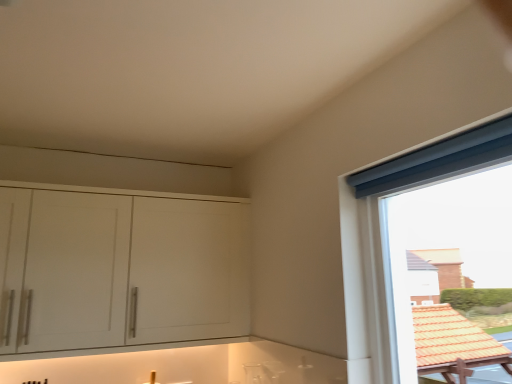
Question: From a real-world perspective, does blue fabric curtain at upper right stand above white matte cabinet at left?

Choices:
 (A) no
 (B) yes

Answer: (A)

Question: Considering the relative sizes of blue fabric curtain at upper right and white matte cabinet at left in the image provided, is blue fabric curtain at upper right wider than white matte cabinet at left?

Choices:
 (A) yes
 (B) no

Answer: (B)

Question: Is blue fabric curtain at upper right surrounding white matte cabinet at left?

Choices:
 (A) no
 (B) yes

Answer: (A)

Question: Does blue fabric curtain at upper right appear on the right side of white matte cabinet at left?

Choices:
 (A) no
 (B) yes

Answer: (B)

Question: Can you confirm if blue fabric curtain at upper right is smaller than white matte cabinet at left?

Choices:
 (A) no
 (B) yes

Answer: (B)

Question: Is blue fabric curtain at upper right to the left of white matte cabinet at left from the viewer's perspective?

Choices:
 (A) yes
 (B) no

Answer: (B)

Question: Does white matte cabinet at left have a greater width compared to blue fabric curtain at upper right?

Choices:
 (A) no
 (B) yes

Answer: (B)

Question: Is white matte cabinet at left shorter than blue fabric curtain at upper right?

Choices:
 (A) no
 (B) yes

Answer: (B)

Question: Is white matte cabinet at left turned away from blue fabric curtain at upper right?

Choices:
 (A) yes
 (B) no

Answer: (B)

Question: Is the surface of white matte cabinet at left in direct contact with blue fabric curtain at upper right?

Choices:
 (A) yes
 (B) no

Answer: (B)

Question: Is white matte cabinet at left outside blue fabric curtain at upper right?

Choices:
 (A) yes
 (B) no

Answer: (A)

Question: Is white matte cabinet at left positioned far away from blue fabric curtain at upper right?

Choices:
 (A) no
 (B) yes

Answer: (B)

Question: In terms of size, does blue fabric curtain at upper right appear bigger or smaller than white matte cabinet at left?

Choices:
 (A) small
 (B) big

Answer: (A)